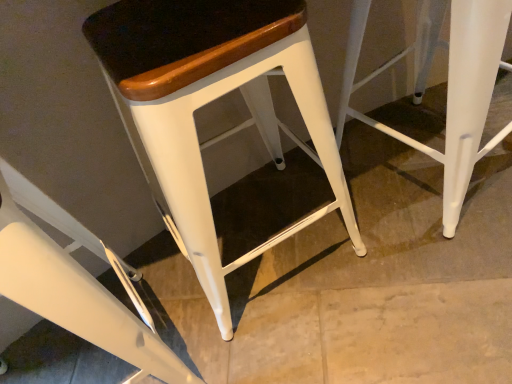
The height and width of the screenshot is (384, 512). What do you see at coordinates (209, 102) in the screenshot?
I see `white painted wood stool at center` at bounding box center [209, 102].

Identify the location of white painted wood stool at center. Image resolution: width=512 pixels, height=384 pixels. (209, 102).

This screenshot has width=512, height=384. What are the coordinates of `white painted wood stool at center` in the screenshot? It's located at (209, 102).